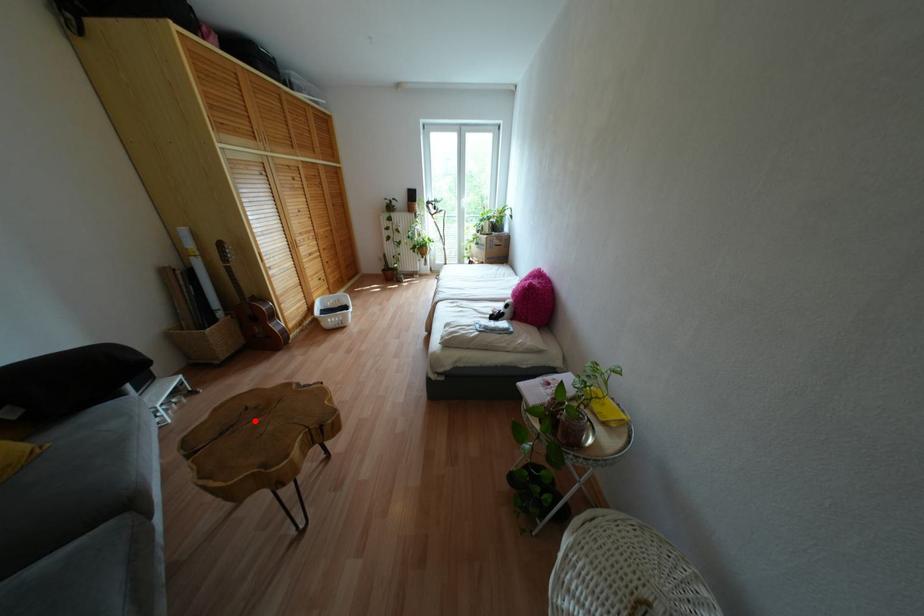
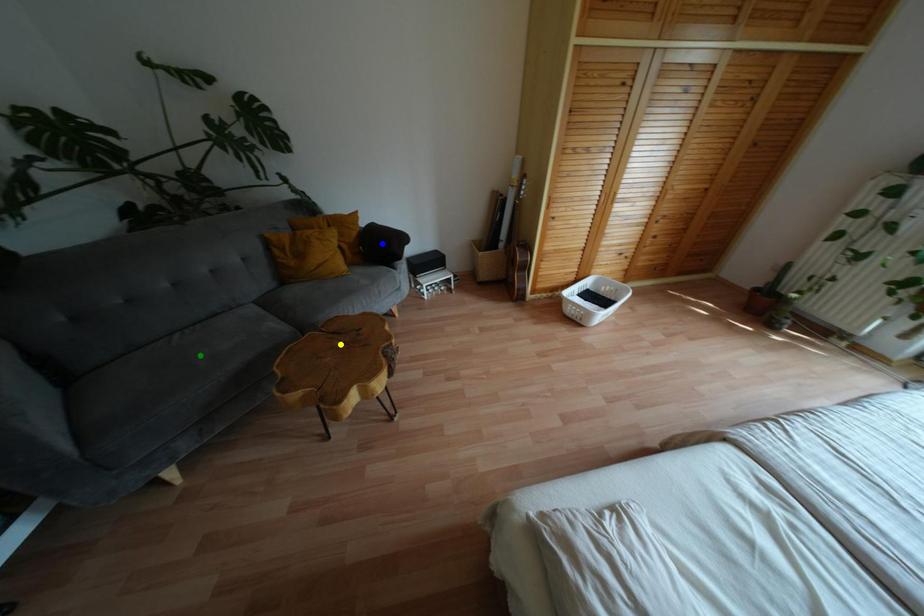
Question: I am providing you with two images of the same scene from different viewpoints. A red point is marked on the first image. You are given multiple points on the second image. In image 2, which mark is for the same physical point as the one in image 1?

Choices:
 (A) yellow point
 (B) green point
 (C) blue point

Answer: (A)